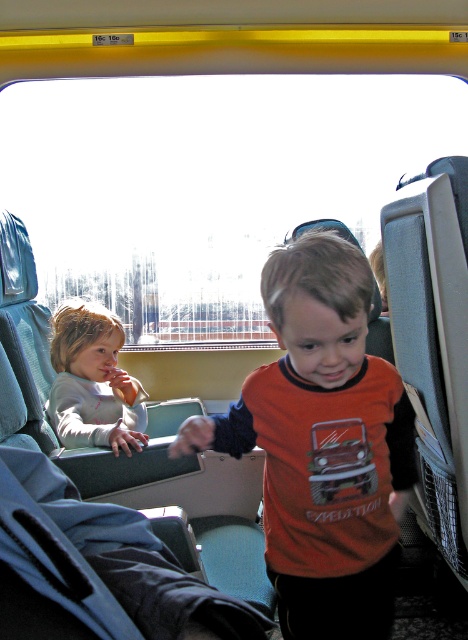
You are a tailor who needs to determine which of the two shirts, the orange matte shirt at center or the light gray fleece shirt at left, requires more fabric for a custom order. Based on the image, which shirt would need more fabric?

The orange matte shirt at center requires more fabric because its width is larger than the light gray fleece shirt at left.

You are a passenger on a train and need to stow a small backpack. You see the blue fabric coach at lower left and the light gray fleece shirt at left. Which one is located lower in the scene?

The blue fabric coach at lower left is located below the light gray fleece shirt at left, so it is lower in the scene.

You are a passenger on a train and need to store your backpack. You see a blue fabric coach at lower left and a light gray fleece shirt at left. Which one is larger and can fit your backpack?

The light gray fleece shirt at left is larger than the blue fabric coach at lower left, so it can fit your backpack.